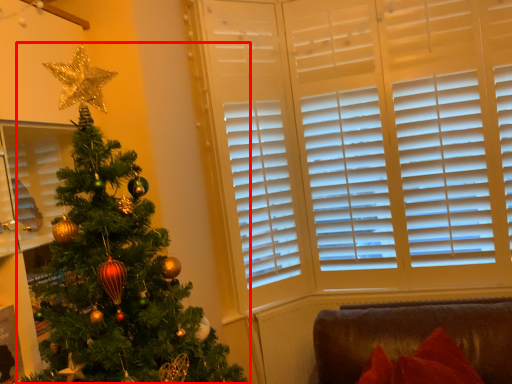
Question: Observing the image, what is the correct spatial positioning of christmas tree (annotated by the red box) in reference to furniture?

Choices:
 (A) left
 (B) right

Answer: (A)